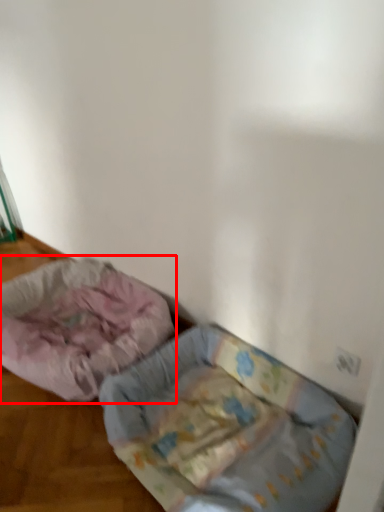
Question: From the image, what is the correct spatial relationship of dog bed (annotated by the red box) in relation to dog bed?

Choices:
 (A) right
 (B) left

Answer: (B)